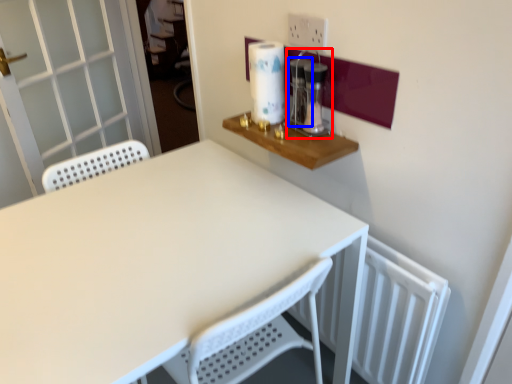
Question: Which of the following is the farthest to the observer, coffee machine (highlighted by a red box) or appliance (highlighted by a blue box)?

Choices:
 (A) coffee machine
 (B) appliance

Answer: (B)